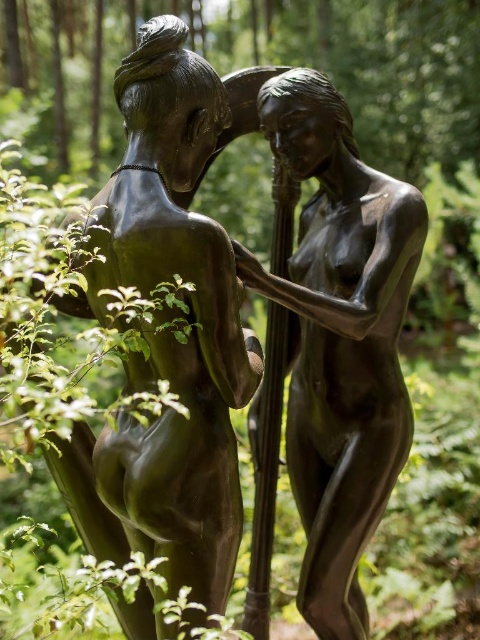
Can you confirm if bronze statue at center is shorter than shiny bronze statue at center?

Indeed, bronze statue at center has a lesser height compared to shiny bronze statue at center.

Is bronze statue at center positioned behind shiny bronze statue at center?

No, it is in front of shiny bronze statue at center.

Image resolution: width=480 pixels, height=640 pixels. What do you see at coordinates (167, 333) in the screenshot?
I see `bronze statue at center` at bounding box center [167, 333].

The width and height of the screenshot is (480, 640). Find the location of `bronze statue at center`. bronze statue at center is located at coordinates (167, 333).